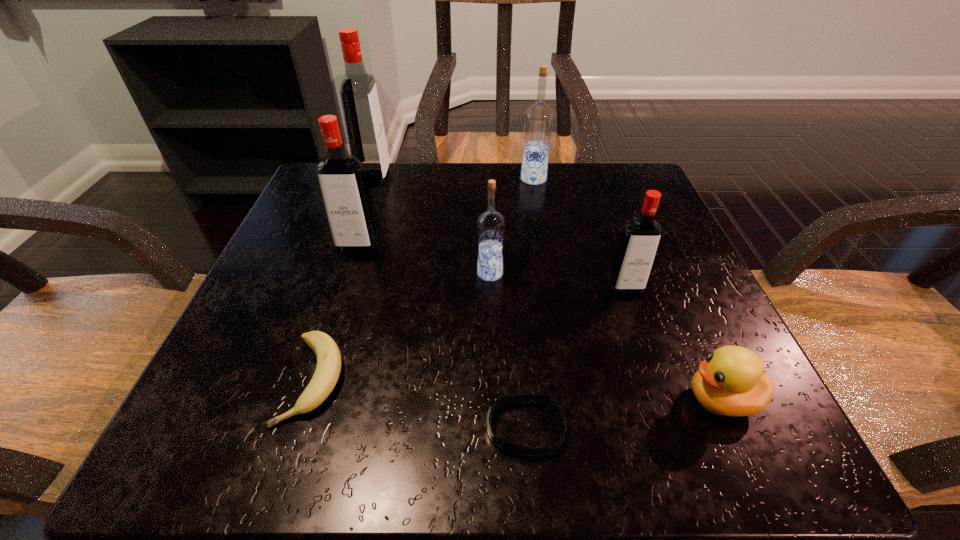
What are the coordinates of `free point between the duckling and the sixth nearest object` in the screenshot? It's located at pyautogui.click(x=540, y=322).

The width and height of the screenshot is (960, 540). I want to click on vacant space that's between the second shortest object and the smaller blue vodka, so click(401, 327).

Where is `free space between the seventh tallest object and the second smallest red vodka`? The width and height of the screenshot is (960, 540). free space between the seventh tallest object and the second smallest red vodka is located at coordinates (335, 312).

I want to click on free area in between the wristband and the third vodka from left to right, so point(508,350).

You are a GUI agent. You are given a task and a screenshot of the screen. Output one action in this format:
    pyautogui.click(x=<x>, y=<y>)
    Task: Click on the vacant area that lies between the tallest vodka and the yellow banana
    The width and height of the screenshot is (960, 540).
    Given the screenshot: What is the action you would take?
    pyautogui.click(x=344, y=279)

Identify the location of empty location between the tallest object and the banana. Image resolution: width=960 pixels, height=540 pixels. (344, 279).

Locate an element on the screen. vacant region between the wristband and the biggest red vodka is located at coordinates (450, 303).

At what (x,y) coordinates should I click in order to perform the action: click on free spot between the shortest object and the third vodka from left to right. Please return your answer as a coordinate pair (x, y). This screenshot has width=960, height=540. Looking at the image, I should click on (508, 350).

Locate an element on the screen. the third closest object to the banana is located at coordinates (491, 224).

The height and width of the screenshot is (540, 960). What are the coordinates of `object that is the closest to the second farthest red vodka` in the screenshot? It's located at (363, 119).